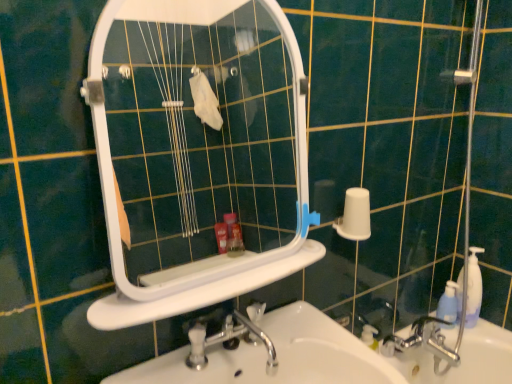
At what (x,y) coordinates should I click in order to perform the action: click on free spot below white plastic mirror at upper center (from a real-world perspective). Please return your answer as a coordinate pair (x, y). The image size is (512, 384). Looking at the image, I should click on (213, 276).